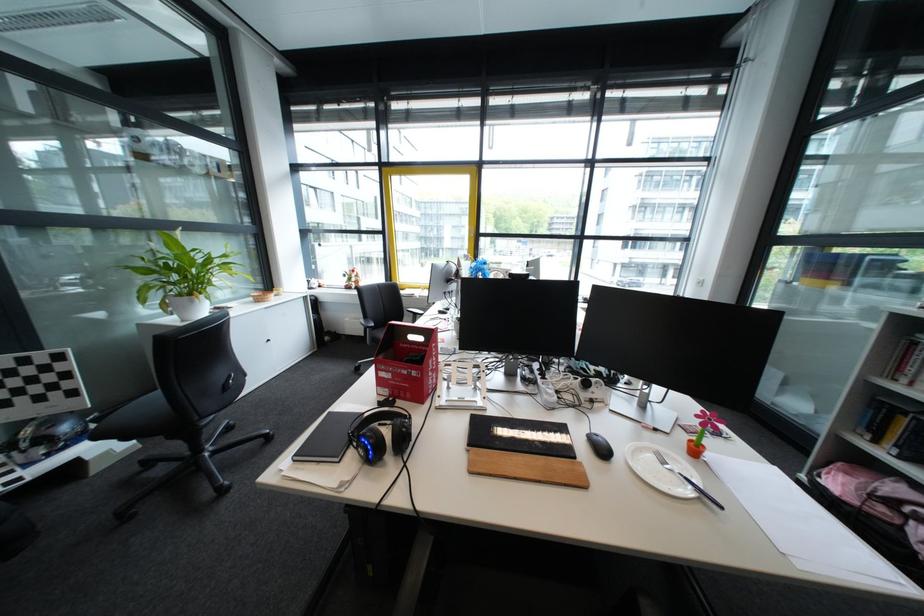
The location [687,480] corresponds to which object?

It corresponds to the silver fork in the image.